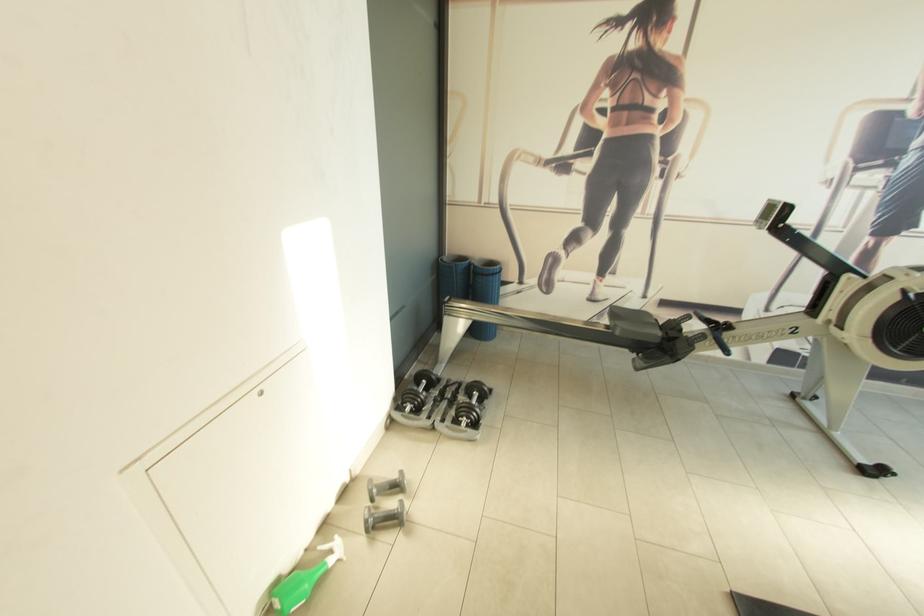
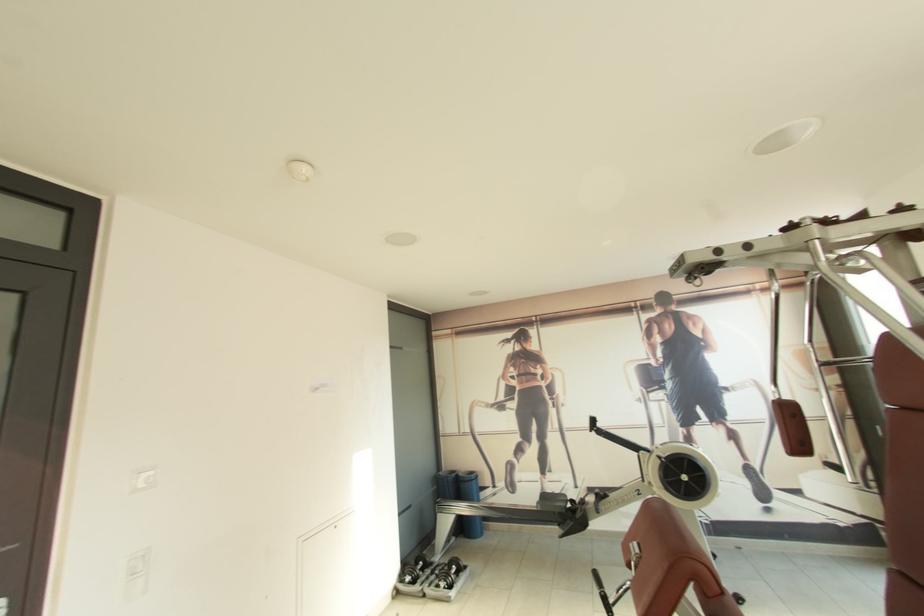
In the second image, find the point that corresponds to (x=451, y=261) in the first image.

(445, 475)